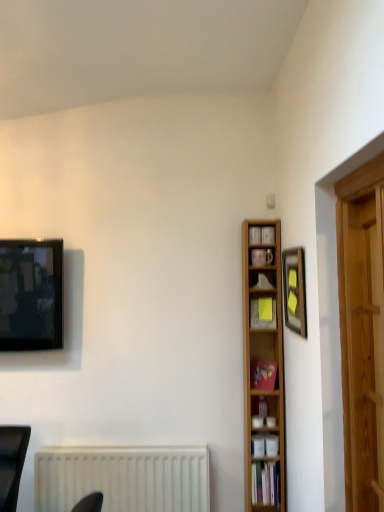
Question: Would you say matte red book at center-right, the 2th book from the bottom, is outside matte black television at upper left?

Choices:
 (A) yes
 (B) no

Answer: (A)

Question: Could you tell me if matte red book at center-right, the 2th book from the bottom, is facing matte black television at upper left?

Choices:
 (A) no
 (B) yes

Answer: (A)

Question: Is matte red book at center-right, marked as the second book in a top-to-bottom arrangement, beside matte black television at upper left?

Choices:
 (A) no
 (B) yes

Answer: (A)

Question: Does matte red book at center-right, the 2th book from the bottom, come behind matte black television at upper left?

Choices:
 (A) yes
 (B) no

Answer: (B)

Question: Does matte red book at center-right, the 2th book from the bottom, appear on the right side of matte black television at upper left?

Choices:
 (A) yes
 (B) no

Answer: (A)

Question: From the image's perspective, is matte red book at center-right, marked as the second book in a top-to-bottom arrangement, above matte black television at upper left?

Choices:
 (A) yes
 (B) no

Answer: (B)

Question: Can you confirm if wooden framed picture at upper right is thinner than hardcover book at lower center, positioned as the first book in bottom-to-top order?

Choices:
 (A) yes
 (B) no

Answer: (A)

Question: Is wooden framed picture at upper right facing away from hardcover book at lower center, arranged as the 3th book when viewed from the top?

Choices:
 (A) yes
 (B) no

Answer: (B)

Question: Can you confirm if wooden framed picture at upper right is wider than hardcover book at lower center, arranged as the 3th book when viewed from the top?

Choices:
 (A) yes
 (B) no

Answer: (B)

Question: Is wooden framed picture at upper right further to camera compared to hardcover book at lower center, arranged as the 3th book when viewed from the top?

Choices:
 (A) no
 (B) yes

Answer: (A)

Question: From the image's perspective, is wooden framed picture at upper right under hardcover book at lower center, arranged as the 3th book when viewed from the top?

Choices:
 (A) no
 (B) yes

Answer: (A)

Question: Are wooden framed picture at upper right and hardcover book at lower center, positioned as the first book in bottom-to-top order, making contact?

Choices:
 (A) yes
 (B) no

Answer: (B)

Question: Is wooden bookcase at right facing away from wooden framed picture at upper right?

Choices:
 (A) yes
 (B) no

Answer: (B)